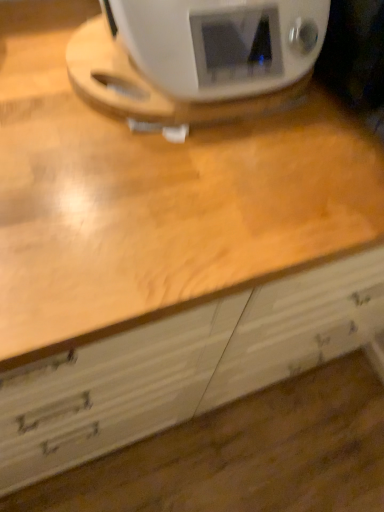
What is the approximate height of white plastic toaster at upper center?

white plastic toaster at upper center is 7.64 inches in height.

You are a GUI agent. You are given a task and a screenshot of the screen. Output one action in this format:
    pyautogui.click(x=<x>, y=<y>)
    Task: Click on the white plastic toaster at upper center
    
    Given the screenshot: What is the action you would take?
    coord(196,58)

Describe the element at coordinates (196, 58) in the screenshot. I see `white plastic toaster at upper center` at that location.

You are a GUI agent. You are given a task and a screenshot of the screen. Output one action in this format:
    pyautogui.click(x=<x>, y=<y>)
    Task: Click on the white plastic toaster at upper center
    
    Given the screenshot: What is the action you would take?
    pyautogui.click(x=196, y=58)